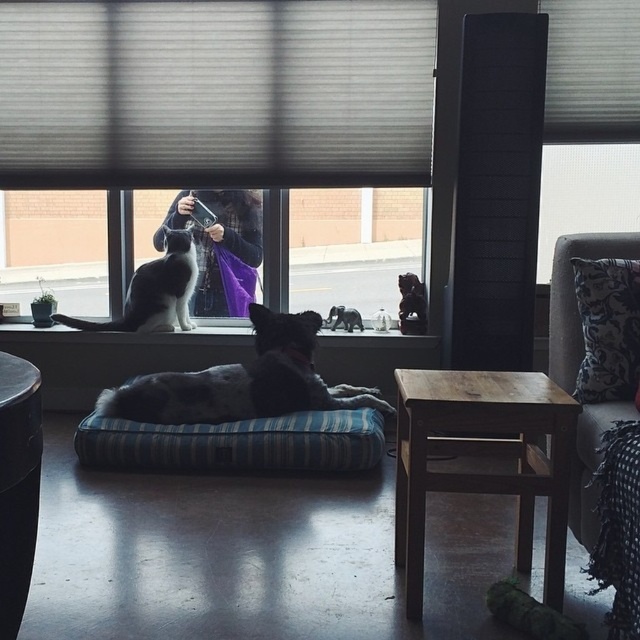
Question: Is black glossy statue at window in front of fluffy gray cat at center?

Choices:
 (A) yes
 (B) no

Answer: (A)

Question: Which point is closer to the camera?

Choices:
 (A) transparent glass window at upper right
 (B) black damask pillow at right
 (C) black and white fur at center

Answer: (B)

Question: Can you confirm if gray fabric couch at right is positioned to the right of black glossy statue at window?

Choices:
 (A) yes
 (B) no

Answer: (A)

Question: Does blue striped cushion at center have a greater width compared to fluffy gray cat at center?

Choices:
 (A) yes
 (B) no

Answer: (A)

Question: Estimate the real-world distances between objects in this image. Which object is closer to the fluffy gray cat at center?

Choices:
 (A) white fabric blinds at upper center
 (B) black and white fur cat at window
 (C) black damask pillow at right

Answer: (B)

Question: Among these objects, which one is farthest from the camera?

Choices:
 (A) wooden stool at lower right
 (B) transparent glass window at upper right
 (C) fluffy gray cat at center

Answer: (C)